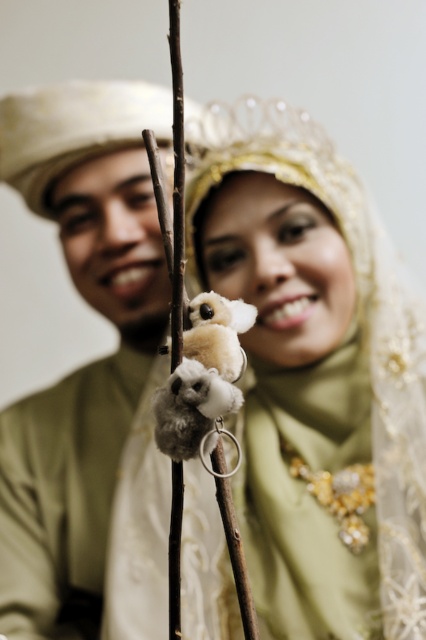
Question: Which object is farther from the camera taking this photo?

Choices:
 (A) fluffy white and gray plush toy at center
 (B) matte green scarf at center
 (C) matte gold turban at left

Answer: (C)

Question: Does matte green scarf at center appear over matte gold turban at left?

Choices:
 (A) yes
 (B) no

Answer: (A)

Question: Which object is positioned farthest from the matte green scarf at center?

Choices:
 (A) matte gold turban at left
 (B) fluffy white and gray plush toy at center

Answer: (B)

Question: Is matte green scarf at center positioned before fluffy white and gray plush toy at center?

Choices:
 (A) yes
 (B) no

Answer: (B)

Question: Which point is farther to the camera?

Choices:
 (A) (241, 131)
 (B) (143, 198)

Answer: (B)

Question: Is matte green scarf at center thinner than matte gold turban at left?

Choices:
 (A) yes
 (B) no

Answer: (B)